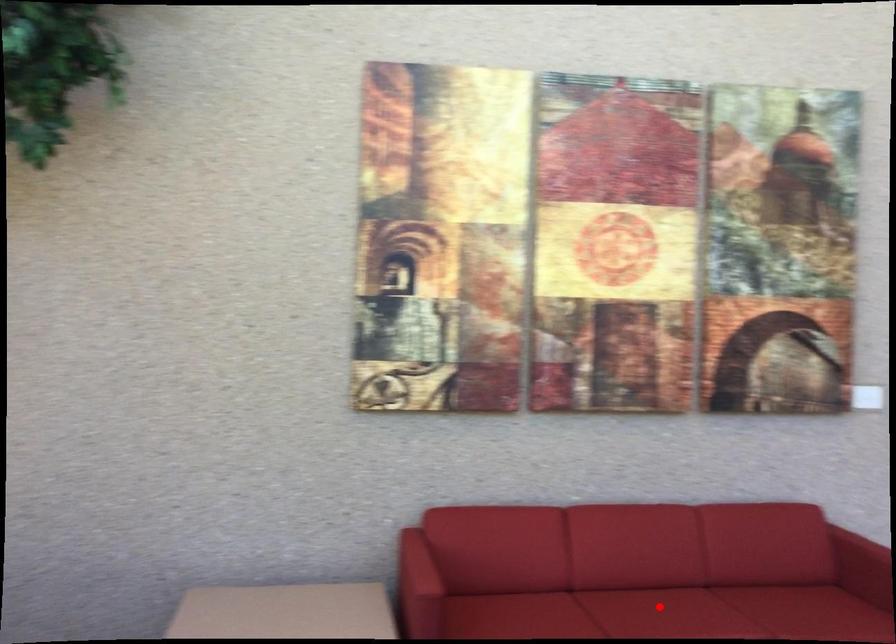
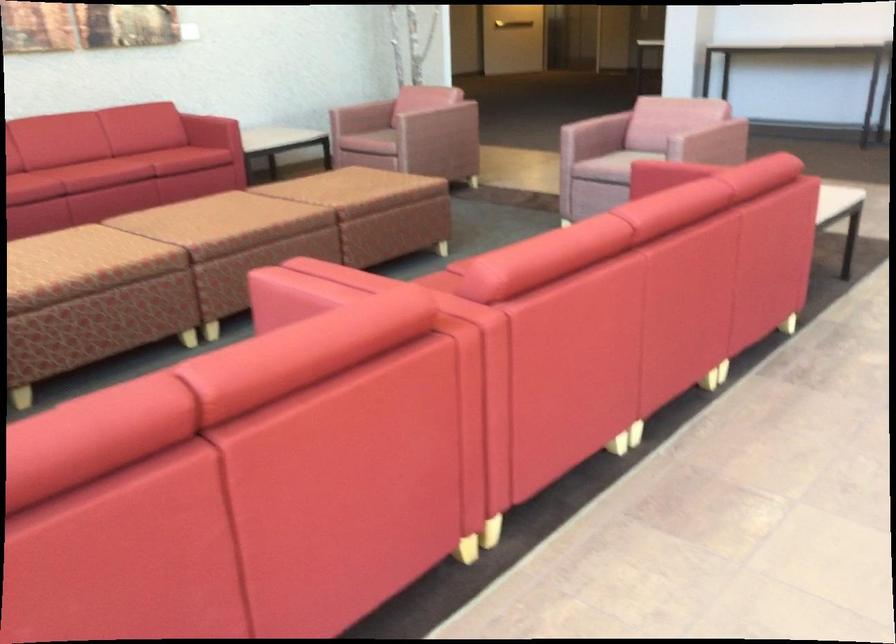
Question: I am providing you with two images of the same scene from different viewpoints. A red point is marked on the first image. Can you still see the location of the red point in image 2?

Choices:
 (A) Yes
 (B) No

Answer: (B)